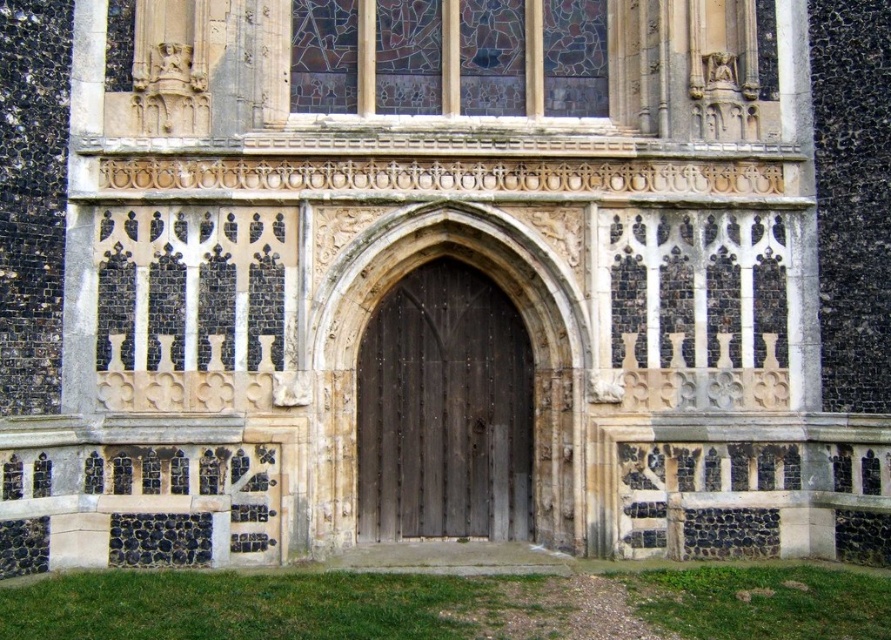
Question: Does dark wood door at center have a larger size compared to stained glass at upper center?

Choices:
 (A) no
 (B) yes

Answer: (A)

Question: Where is dark wood door at center located in relation to stained glass at upper center in the image?

Choices:
 (A) below
 (B) above

Answer: (A)

Question: Among these points, which one is farthest from the camera?

Choices:
 (A) (382, 445)
 (B) (311, 22)

Answer: (B)

Question: Which object is farther from the camera taking this photo?

Choices:
 (A) dark wood door at center
 (B) stained glass at upper center

Answer: (B)

Question: Can you confirm if dark wood door at center is positioned to the left of stained glass at upper center?

Choices:
 (A) yes
 (B) no

Answer: (A)